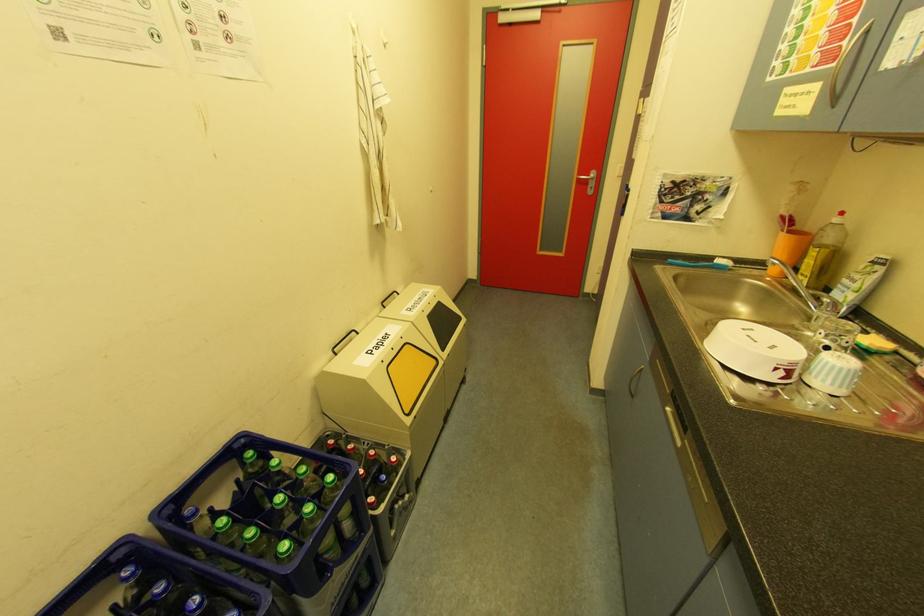
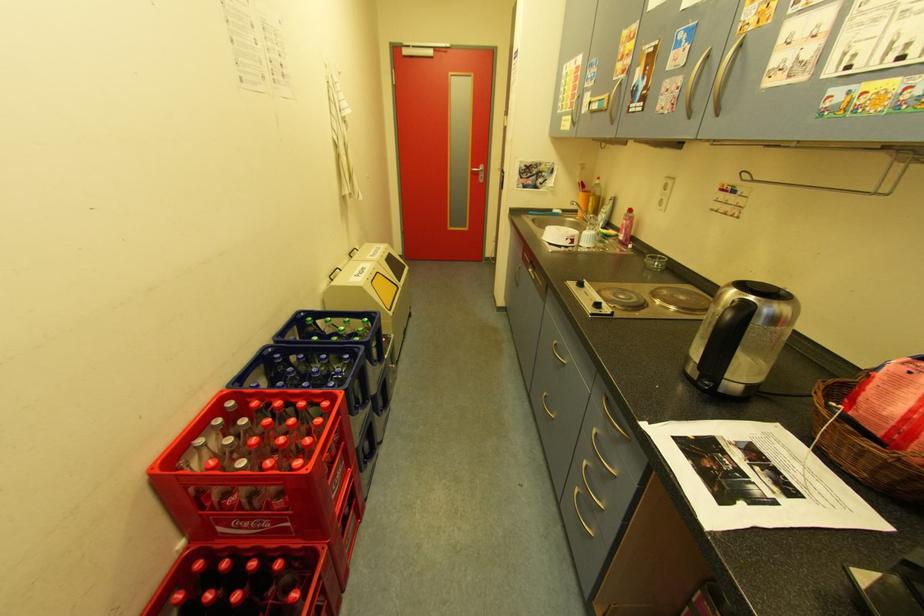
Question: The camera is either moving clockwise (left) or counter-clockwise (right) around the object. The first image is from the beginning of the video and the second image is from the end. Is the camera moving left or right when shooting the video?

Choices:
 (A) Left
 (B) Right

Answer: (A)